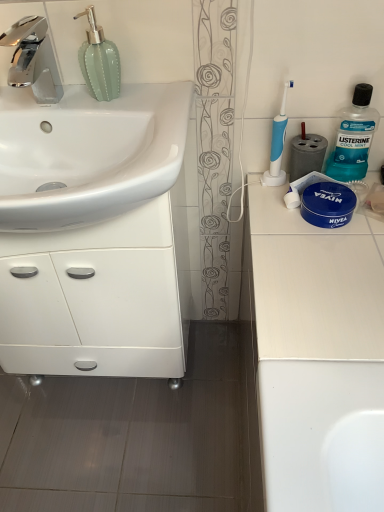
Question: Does green glass soap dispenser at upper left have a larger size compared to blue plastic toothbrush at upper right?

Choices:
 (A) yes
 (B) no

Answer: (A)

Question: Considering the relative sizes of green glass soap dispenser at upper left and blue plastic toothbrush at upper right in the image provided, is green glass soap dispenser at upper left shorter than blue plastic toothbrush at upper right?

Choices:
 (A) no
 (B) yes

Answer: (B)

Question: Does green glass soap dispenser at upper left have a smaller size compared to blue plastic toothbrush at upper right?

Choices:
 (A) yes
 (B) no

Answer: (B)

Question: Can you confirm if green glass soap dispenser at upper left is taller than blue plastic toothbrush at upper right?

Choices:
 (A) yes
 (B) no

Answer: (B)

Question: From the image's perspective, is green glass soap dispenser at upper left under blue plastic toothbrush at upper right?

Choices:
 (A) yes
 (B) no

Answer: (B)

Question: Can you confirm if green glass soap dispenser at upper left is positioned to the left of blue plastic toothbrush at upper right?

Choices:
 (A) no
 (B) yes

Answer: (B)

Question: From the image's perspective, is white matte countertop at right located beneath white glossy cabinet at left?

Choices:
 (A) yes
 (B) no

Answer: (B)

Question: Considering the relative sizes of white matte countertop at right and white glossy cabinet at left in the image provided, is white matte countertop at right wider than white glossy cabinet at left?

Choices:
 (A) no
 (B) yes

Answer: (B)

Question: Is white matte countertop at right at the right side of white glossy cabinet at left?

Choices:
 (A) yes
 (B) no

Answer: (A)

Question: Can you confirm if white matte countertop at right is thinner than white glossy cabinet at left?

Choices:
 (A) yes
 (B) no

Answer: (B)

Question: Does white matte countertop at right turn towards white glossy cabinet at left?

Choices:
 (A) no
 (B) yes

Answer: (B)

Question: Is white matte countertop at right completely or partially outside of white glossy cabinet at left?

Choices:
 (A) yes
 (B) no

Answer: (A)

Question: From the image's perspective, does white glossy sink at left appear higher than white glossy cabinet at left?

Choices:
 (A) yes
 (B) no

Answer: (A)